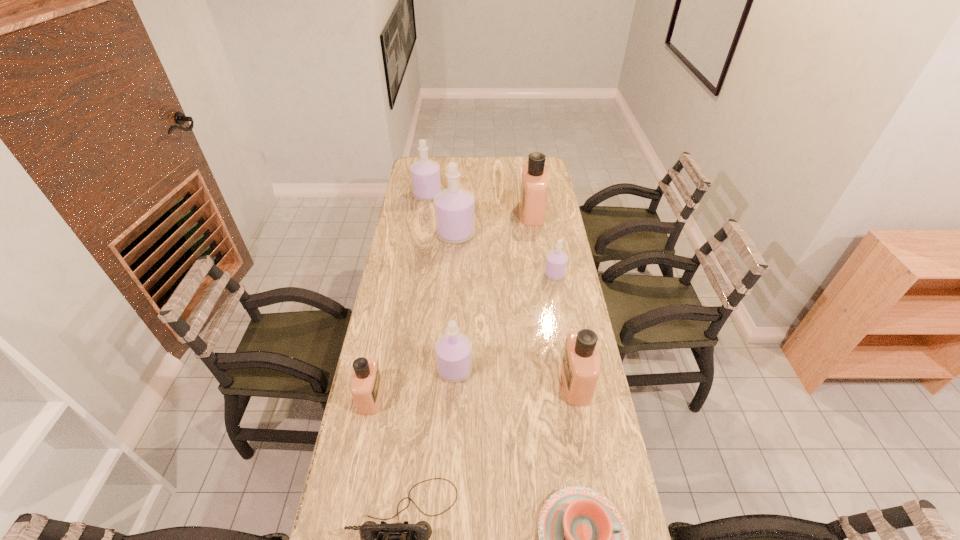
Identify the location of blank space located on the front label of the biggest beige perfume. (467, 212).

Where is `vacant space located 0.210m on the front label of the biggest beige perfume`? The image size is (960, 540). vacant space located 0.210m on the front label of the biggest beige perfume is located at coordinates (477, 212).

You are a GUI agent. You are given a task and a screenshot of the screen. Output one action in this format:
    pyautogui.click(x=<x>, y=<y>)
    Task: Click on the blank space located 0.160m on the front label of the biggest beige perfume
    This screenshot has width=960, height=540.
    Given the screenshot: What is the action you would take?
    pos(488,212)

Find the location of `vacant space located on the back of the third smallest purple perfume`. vacant space located on the back of the third smallest purple perfume is located at coordinates (430, 178).

This screenshot has width=960, height=540. I want to click on blank space located on the front of the second smallest purple perfume, so click(x=449, y=478).

The image size is (960, 540). I want to click on vacant space situated 0.250m on the front label of the second biggest beige perfume, so click(486, 383).

In order to click on vacant space located on the front label of the second biggest beige perfume in this screenshot , I will do `click(547, 383)`.

This screenshot has width=960, height=540. Identify the location of free location located 0.070m on the front label of the second biggest beige perfume. (540, 383).

Locate an element on the screen. The height and width of the screenshot is (540, 960). vacant area located on the front of the rightmost purple perfume is located at coordinates (569, 357).

The width and height of the screenshot is (960, 540). In order to click on vacant space located on the front label of the leftmost beige perfume in this screenshot , I will do `click(419, 397)`.